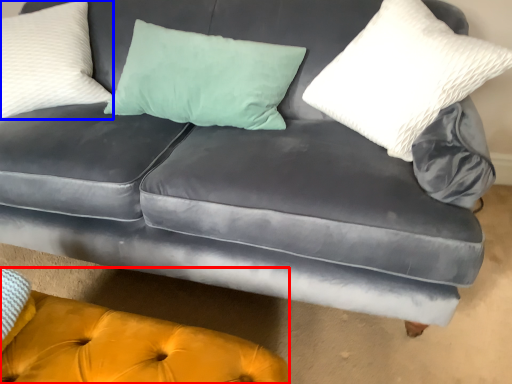
Question: Which point is further to the camera, couch (highlighted by a red box) or pillow (highlighted by a blue box)?

Choices:
 (A) couch
 (B) pillow

Answer: (B)